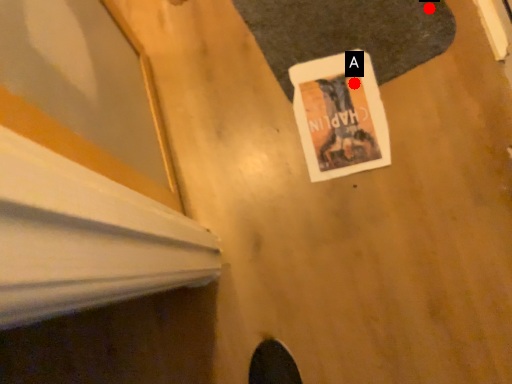
Question: Two points are circled on the image, labeled by A and B beside each circle. Which point appears farthest from the camera in this image?

Choices:
 (A) A is further
 (B) B is further

Answer: (B)